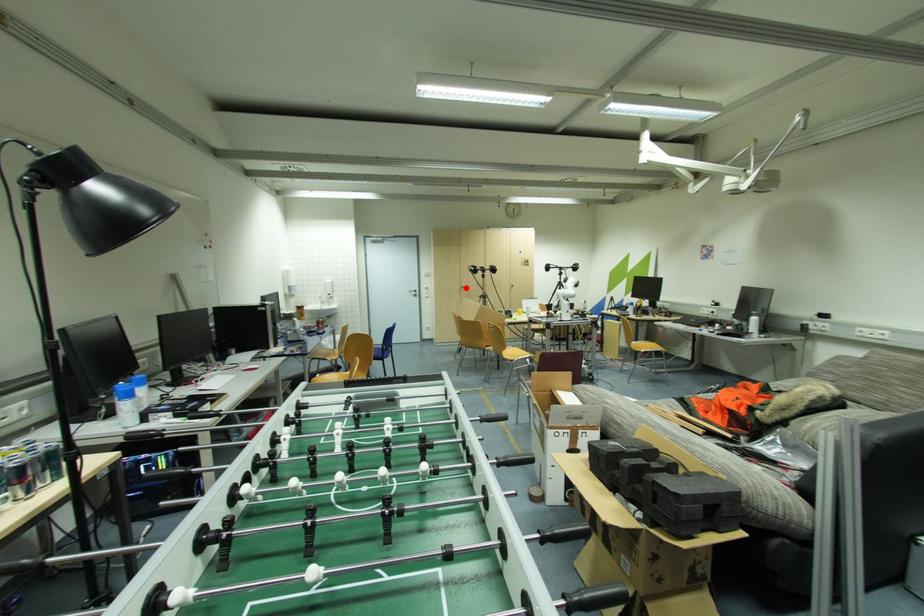
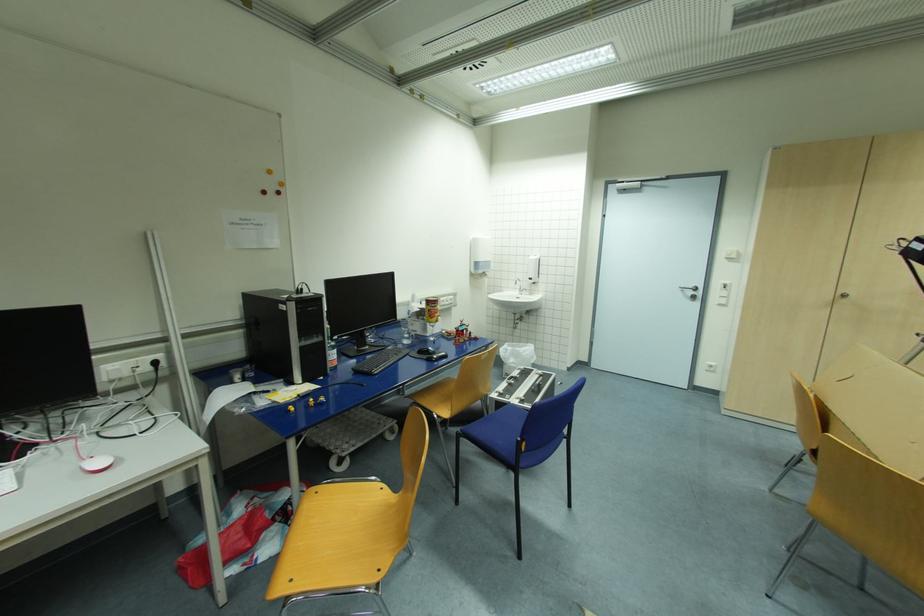
Question: I am providing you with two images of the same scene from different viewpoints. Image1 has a red point marked. In image2, the corresponding 3D location appears at what relative position? Reply with the corresponding letter.

Choices:
 (A) Closer
 (B) Farther

Answer: (B)